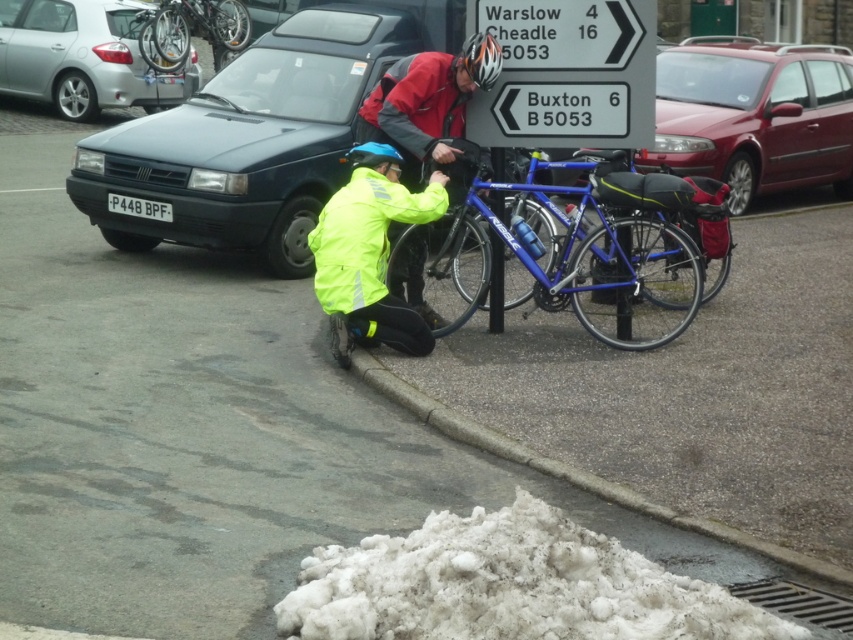
You are a delivery person who needs to park your van between the matte black car at left and the metallic red car at right. Is there enough space between them to fit your van which is 2.5 meters wide?

The matte black car at left is positioned on the left side of metallic red car at right, but the exact distance between them is not provided. Without knowing the space between the two cars, it is impossible to determine if the van will fit.